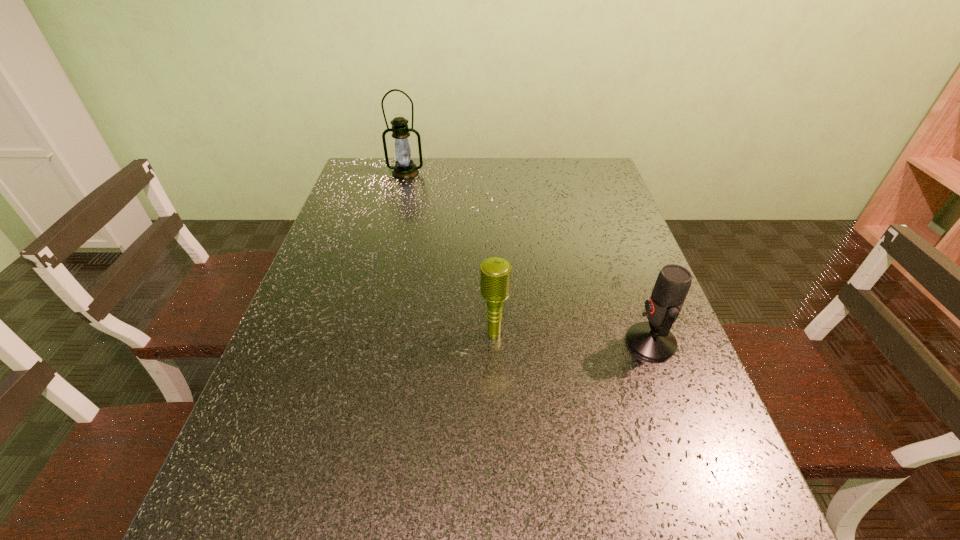
The width and height of the screenshot is (960, 540). In order to click on object positioned at the left edge in this screenshot , I will do `click(404, 168)`.

At what (x,y) coordinates should I click in order to perform the action: click on object at the right edge. Please return your answer as a coordinate pair (x, y). The width and height of the screenshot is (960, 540). Looking at the image, I should click on (653, 341).

Identify the location of object positioned at the far left corner. This screenshot has width=960, height=540. (404, 168).

In the image, there is a desktop. Identify the location of free space at the far edge. This screenshot has width=960, height=540. (530, 171).

Where is `vacant space at the left edge of the desktop`? vacant space at the left edge of the desktop is located at coordinates (310, 454).

In the image, there is a desktop. At what (x,y) coordinates should I click in order to perform the action: click on vacant space at the right edge. Please return your answer as a coordinate pair (x, y). The width and height of the screenshot is (960, 540). Looking at the image, I should click on (690, 462).

Identify the location of blank space at the far left corner. (358, 160).

Where is `vacant space in between the left microphone and the farthest object`? The width and height of the screenshot is (960, 540). vacant space in between the left microphone and the farthest object is located at coordinates coord(450,253).

Identify the location of vacant space that's between the rightmost object and the lantern. (528, 258).

Where is `free area in between the left microphone and the tallest object`? free area in between the left microphone and the tallest object is located at coordinates (450, 253).